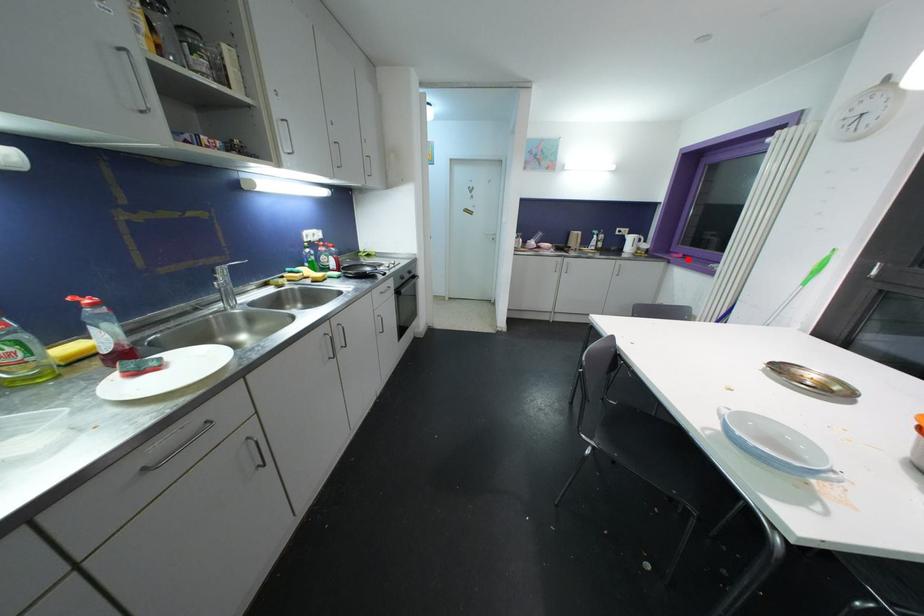
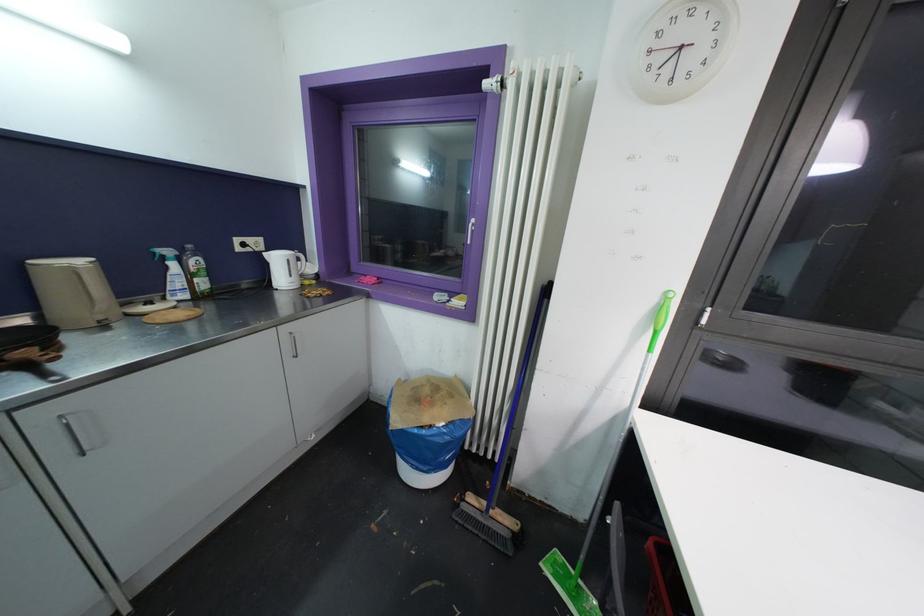
Where in the second image is the point corresponding to the highlighted location from the first image?

(383, 284)